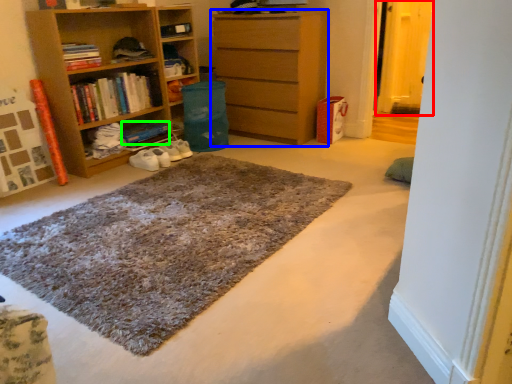
Question: Which is nearer to the glass door (highlighted by a red box)? chest of drawers (highlighted by a blue box) or book (highlighted by a green box).

Choices:
 (A) chest of drawers
 (B) book

Answer: (A)